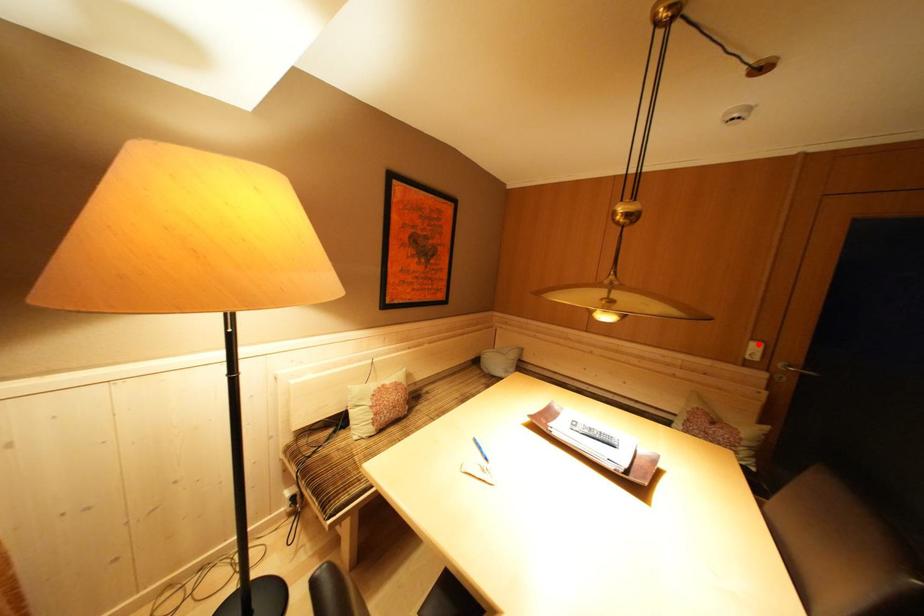
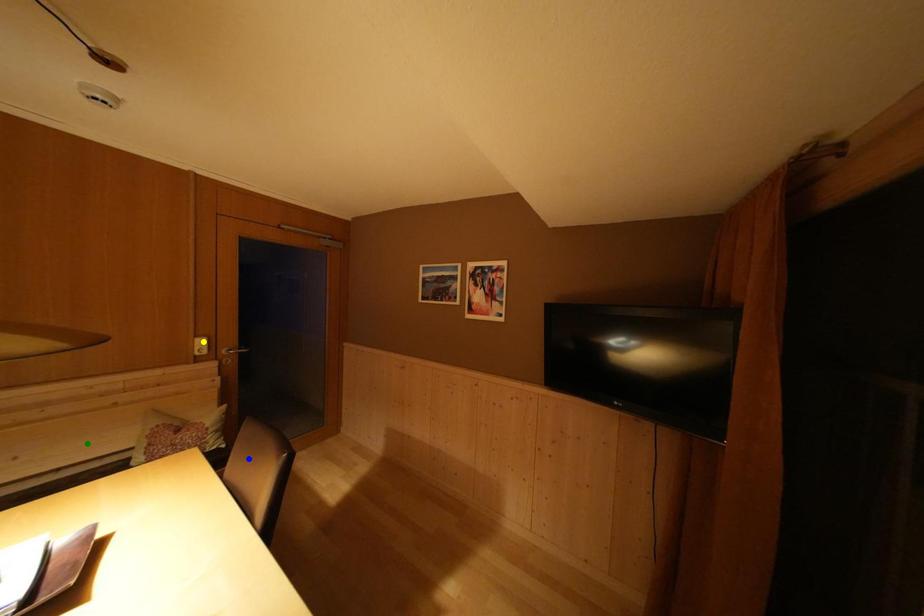
Question: I am providing you with two images of the same scene from different viewpoints. A red point is marked on the first image. You are given multiple points on the second image. Can you choose the point in image 2 that corresponds to the point in image 1?

Choices:
 (A) yellow point
 (B) green point
 (C) blue point

Answer: (A)